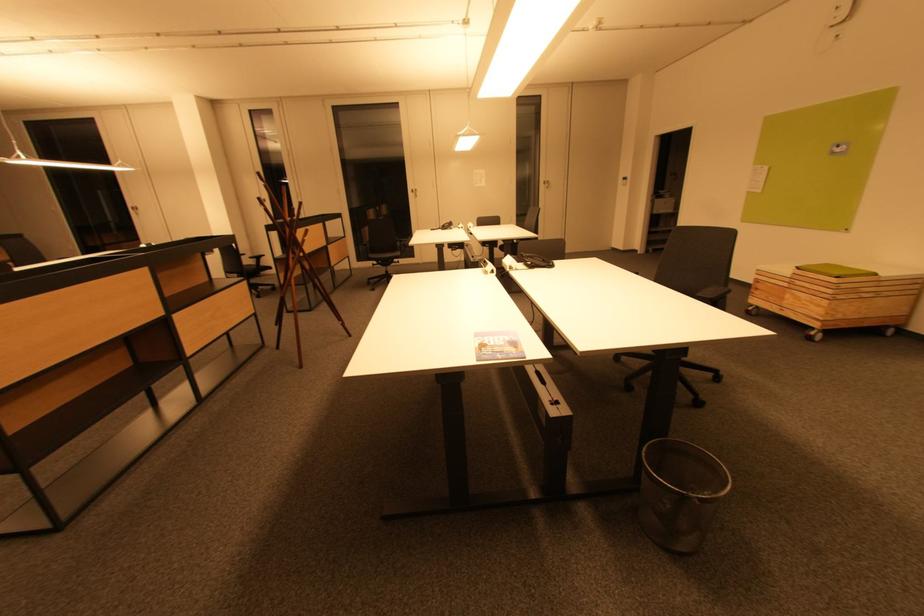
You are a GUI agent. You are given a task and a screenshot of the screen. Output one action in this format:
    pyautogui.click(x=<x>, y=<y>)
    Task: Click on the desk control panel
    The image size is (924, 616).
    Given the screenshot: What is the action you would take?
    pyautogui.click(x=554, y=403)